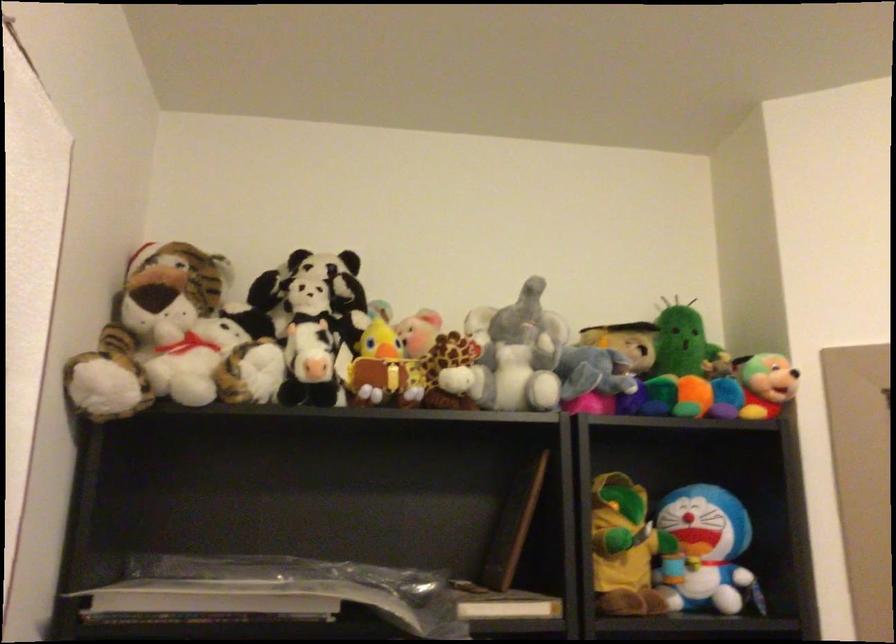
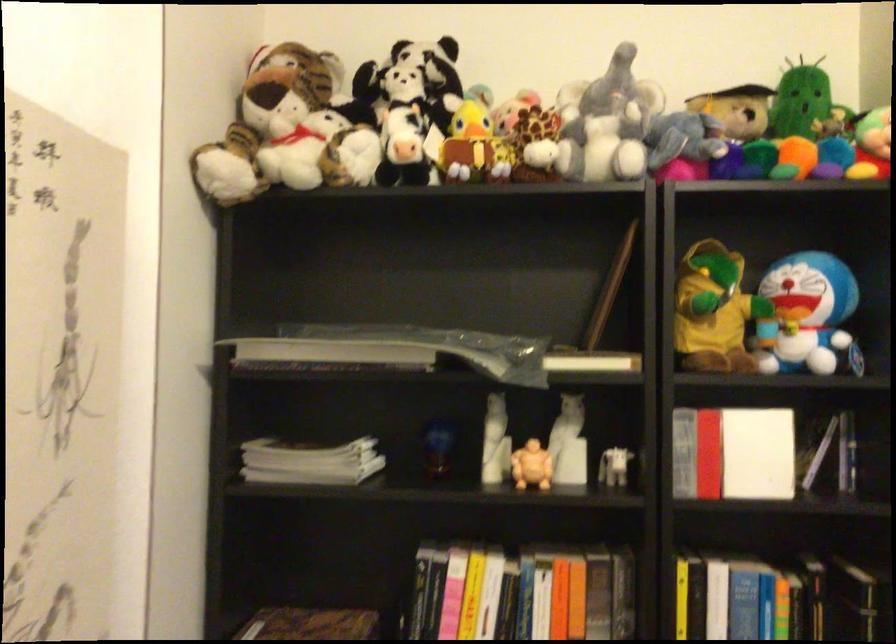
The point at (711, 552) is marked in the first image. Where is the corresponding point in the second image?

(807, 317)